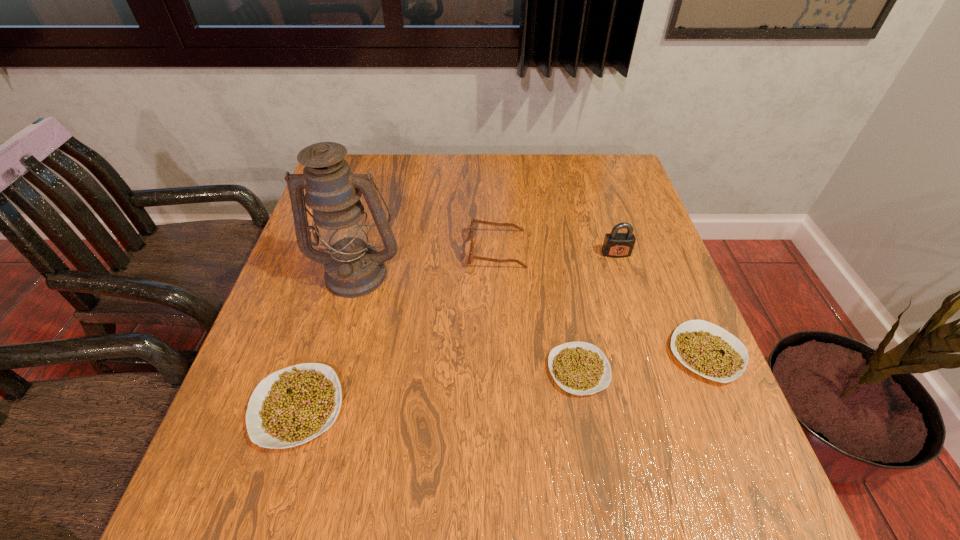
At what (x,y) coordinates should I click in order to perform the action: click on free space that is in between the oil lamp and the second legume from left to right. Please return your answer as a coordinate pair (x, y). The height and width of the screenshot is (540, 960). Looking at the image, I should click on (468, 321).

At what (x,y) coordinates should I click in order to perform the action: click on free spot between the spectacles and the rightmost legume. Please return your answer as a coordinate pair (x, y). This screenshot has height=540, width=960. Looking at the image, I should click on (602, 301).

The height and width of the screenshot is (540, 960). Identify the location of free area in between the spectacles and the leftmost legume. (397, 328).

Where is `unoccupied position between the third tallest object and the shortest legume`? unoccupied position between the third tallest object and the shortest legume is located at coordinates (538, 310).

You are a GUI agent. You are given a task and a screenshot of the screen. Output one action in this format:
    pyautogui.click(x=<x>, y=<y>)
    Task: Click on the vacant area between the fourth object from right to left and the tallest object
    Image resolution: width=960 pixels, height=540 pixels.
    Given the screenshot: What is the action you would take?
    pyautogui.click(x=427, y=261)

Locate an element on the screen. The image size is (960, 540). vacant space in between the second tallest object and the second legume from right to left is located at coordinates (597, 312).

Locate an element on the screen. The width and height of the screenshot is (960, 540). empty location between the third object from left to right and the second legume from left to right is located at coordinates (538, 310).

The height and width of the screenshot is (540, 960). What are the coordinates of `vacant point located between the padlock and the third tallest object` in the screenshot? It's located at (557, 252).

At what (x,y) coordinates should I click in order to perform the action: click on unoccupied area between the padlock and the fourth object from left to right. Please return your answer as a coordinate pair (x, y). Looking at the image, I should click on click(x=597, y=312).

Locate which object is the fourth closest to the second tallest legume. Please provide its 2D coordinates. Your answer should be formatted as a tuple, i.e. [(x, y)], where the tuple contains the x and y coordinates of a point satisfying the conditions above.

[(353, 268)]